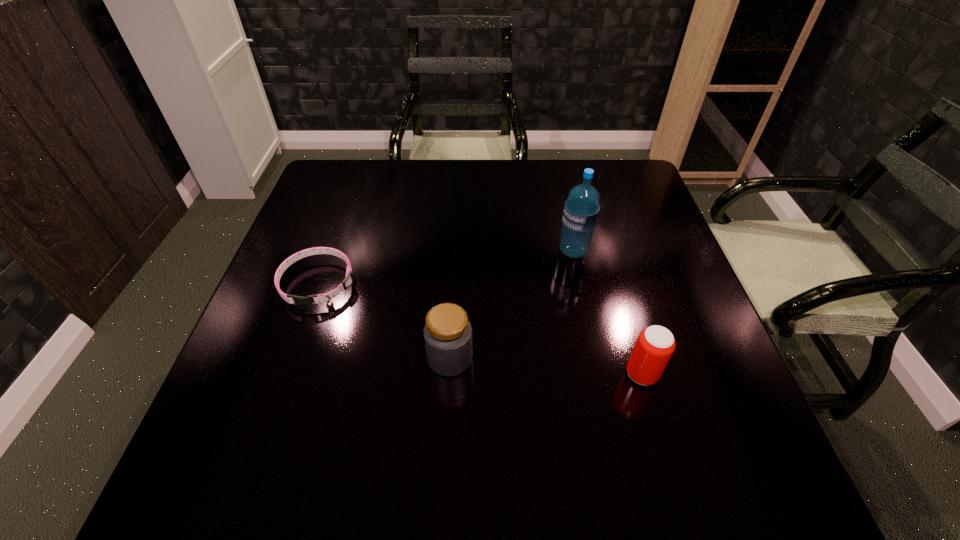
Where is `water bottle`? The height and width of the screenshot is (540, 960). water bottle is located at coordinates (581, 209).

Find the location of a particular element. The height and width of the screenshot is (540, 960). the second object from right to left is located at coordinates (581, 209).

I want to click on jar, so point(448,334).

At what (x,y) coordinates should I click in order to perform the action: click on beer can. Please return your answer as a coordinate pair (x, y). The height and width of the screenshot is (540, 960). Looking at the image, I should click on (655, 345).

The image size is (960, 540). Identify the location of the leftmost object. (346, 283).

You are a GUI agent. You are given a task and a screenshot of the screen. Output one action in this format:
    pyautogui.click(x=<x>, y=<y>)
    Task: Click on the shortest object
    The image size is (960, 540).
    Given the screenshot: What is the action you would take?
    pyautogui.click(x=346, y=283)

Image resolution: width=960 pixels, height=540 pixels. What are the coordinates of `vacant area situated on the front of the second object from right to left` in the screenshot? It's located at (582, 289).

The image size is (960, 540). I want to click on vacant space located 0.270m on the surface of the jar near the warning symbol, so click(x=606, y=358).

What are the coordinates of `free location located on the front of the beer can` in the screenshot? It's located at (653, 413).

Identify the location of vacant region located with the buckle on the shortest object. (274, 411).